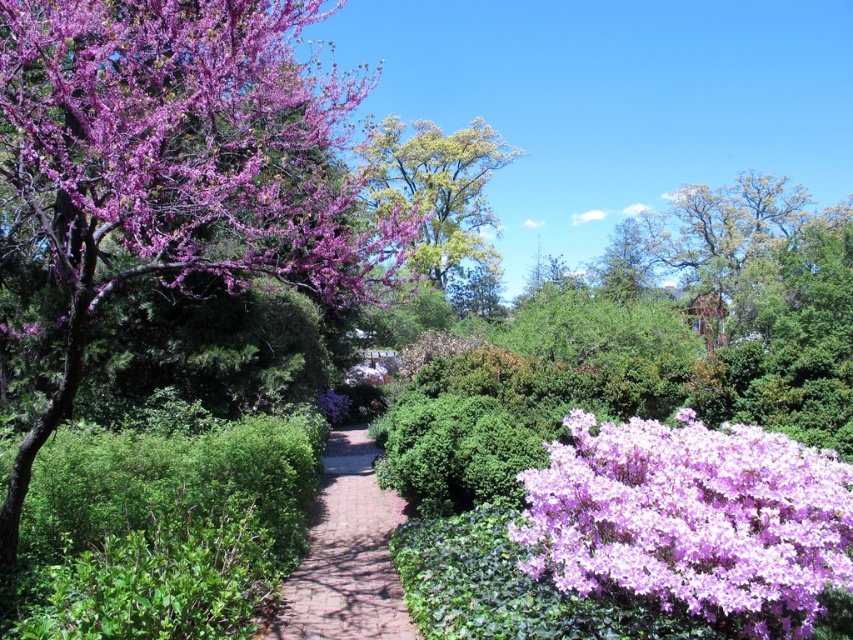
Does purple matte flowers at lower right lie in front of brick paved path at center?

Yes, it is.

Locate an element on the screen. The image size is (853, 640). purple matte flowers at lower right is located at coordinates (692, 518).

Is purple matte tree at upper left above brick paved path at center?

Indeed, purple matte tree at upper left is positioned over brick paved path at center.

Between point (231, 225) and point (260, 634), which one is positioned behind?

Point (231, 225)

The height and width of the screenshot is (640, 853). Find the location of `purple matte tree at upper left`. purple matte tree at upper left is located at coordinates (187, 147).

This screenshot has height=640, width=853. Describe the element at coordinates (187, 147) in the screenshot. I see `purple matte tree at upper left` at that location.

Does point (196, 88) lie in front of point (508, 154)?

Yes.

Locate an element on the screen. The image size is (853, 640). purple matte tree at upper left is located at coordinates (187, 147).